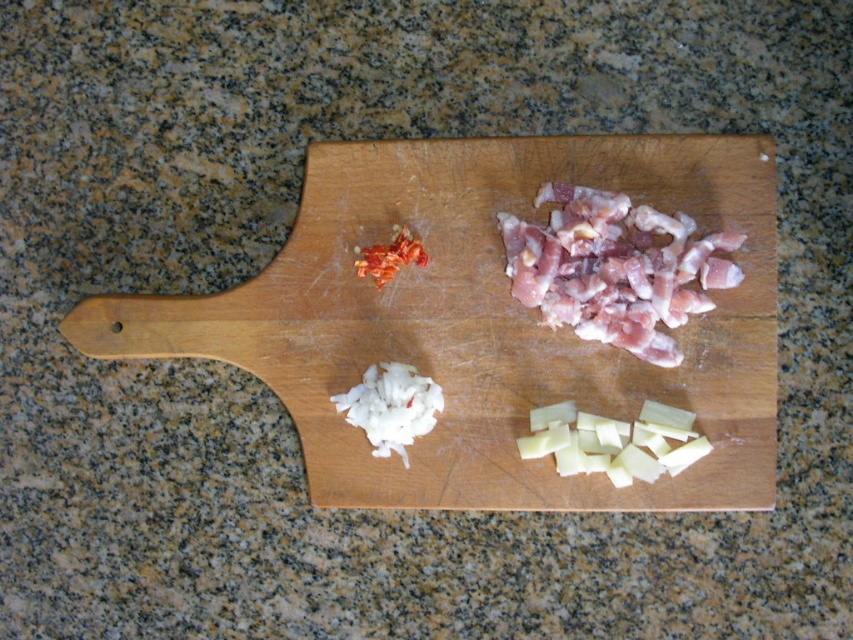
You are preparing a cheese platter and need to place the white creamy cheese at bottom right on the wooden cutting board at center. Considering the size of the board, will there be enough space left after placing the cheese?

The wooden cutting board at center has a larger size compared to white creamy cheese at bottom right, so there will be sufficient space left on the wooden cutting board at center after placing the white creamy cheese at bottom right.

You are a chef standing at the counter and need to grab the white creamy cheese at bottom right quickly. Is it within arm reach? Assume your arm can extend 3.5 feet.

The white creamy cheese at bottom right is 4.00 feet away from the camera, which is slightly beyond your arm reach of 3.5 feet. You may need to take a small step forward to grab it.